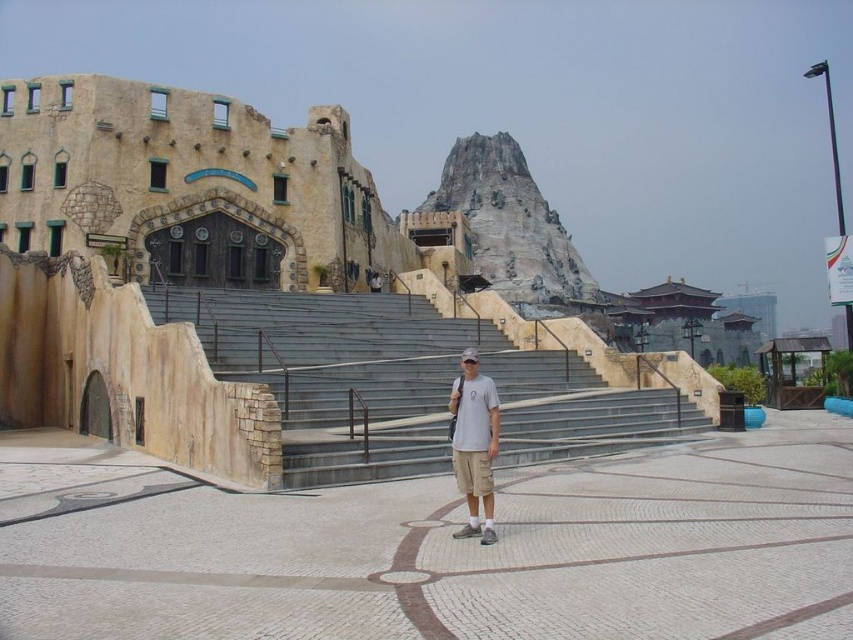
Is rocky gray at center positioned behind white cotton t-shirt at center?

Yes.

Does rocky gray at center have a lesser width compared to white cotton t-shirt at center?

Incorrect, rocky gray at center's width is not less than white cotton t-shirt at center's.

Is point (514, 188) positioned in front of point (476, 480)?

No, (514, 188) is further to viewer.

Image resolution: width=853 pixels, height=640 pixels. In order to click on rocky gray at center in this screenshot , I will do `click(509, 224)`.

Does concrete stairs at center have a lesser height compared to rocky gray at center?

Yes, concrete stairs at center is shorter than rocky gray at center.

Between concrete stairs at center and rocky gray at center, which one has more height?

Standing taller between the two is rocky gray at center.

Where is `concrete stairs at center`? concrete stairs at center is located at coordinates (407, 381).

I want to click on concrete stairs at center, so click(x=407, y=381).

Who is lower down, concrete stairs at center or white cotton t-shirt at center?

white cotton t-shirt at center

Does concrete stairs at center have a greater width compared to white cotton t-shirt at center?

Yes.

I want to click on concrete stairs at center, so click(x=407, y=381).

In order to click on concrete stairs at center in this screenshot , I will do `click(407, 381)`.